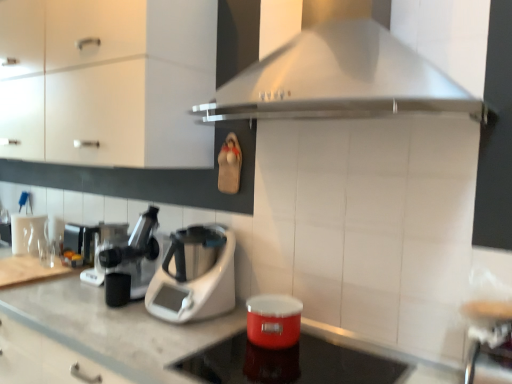
Question: Is matte white cabinet at upper left outside of stainless steel range hood at upper center?

Choices:
 (A) yes
 (B) no

Answer: (A)

Question: Considering the relative sizes of matte white cabinet at upper left and stainless steel range hood at upper center in the image provided, is matte white cabinet at upper left thinner than stainless steel range hood at upper center?

Choices:
 (A) yes
 (B) no

Answer: (A)

Question: Considering the relative sizes of matte white cabinet at upper left and stainless steel range hood at upper center in the image provided, is matte white cabinet at upper left taller than stainless steel range hood at upper center?

Choices:
 (A) no
 (B) yes

Answer: (B)

Question: Is matte white cabinet at upper left to the right of stainless steel range hood at upper center from the viewer's perspective?

Choices:
 (A) yes
 (B) no

Answer: (B)

Question: Are matte white cabinet at upper left and stainless steel range hood at upper center far apart?

Choices:
 (A) no
 (B) yes

Answer: (A)

Question: Can you confirm if matte white cabinet at upper left is shorter than stainless steel range hood at upper center?

Choices:
 (A) no
 (B) yes

Answer: (A)

Question: Does shiny red container at center appear on the right side of metallic silver bar stool at lower right?

Choices:
 (A) no
 (B) yes

Answer: (A)

Question: From the image's perspective, is shiny red container at center on top of metallic silver bar stool at lower right?

Choices:
 (A) no
 (B) yes

Answer: (A)

Question: Is shiny red container at center positioned far away from metallic silver bar stool at lower right?

Choices:
 (A) yes
 (B) no

Answer: (B)

Question: Is shiny red container at center next to metallic silver bar stool at lower right?

Choices:
 (A) no
 (B) yes

Answer: (A)

Question: Considering the relative sizes of shiny red container at center and metallic silver bar stool at lower right in the image provided, is shiny red container at center taller than metallic silver bar stool at lower right?

Choices:
 (A) no
 (B) yes

Answer: (A)

Question: Can you confirm if shiny red container at center is thinner than metallic silver bar stool at lower right?

Choices:
 (A) no
 (B) yes

Answer: (A)

Question: Is metallic silver coffee machine at left, the third coffee machine in the right-to-left sequence, outside of matte white cabinet at upper left?

Choices:
 (A) no
 (B) yes

Answer: (B)